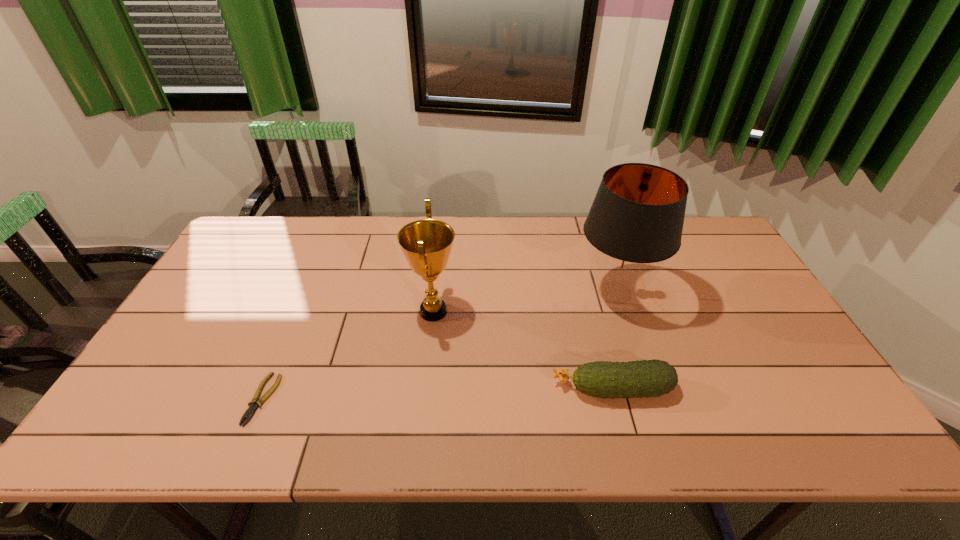
Identify the location of free space located at the blossom end of the cucumber. Image resolution: width=960 pixels, height=540 pixels. (404, 389).

Identify the location of free point located on the left of the shortest object. This screenshot has height=540, width=960. (134, 399).

This screenshot has width=960, height=540. I want to click on object that is positioned at the near edge, so click(250, 411).

At what (x,y) coordinates should I click in order to perform the action: click on free space at the far edge. Please return your answer as a coordinate pair (x, y). Looking at the image, I should click on (404, 225).

The width and height of the screenshot is (960, 540). In order to click on vacant region at the left edge of the desktop in this screenshot , I will do `click(208, 282)`.

The height and width of the screenshot is (540, 960). What are the coordinates of `vacant space at the right edge` in the screenshot? It's located at (767, 345).

This screenshot has height=540, width=960. In the image, there is a desktop. In order to click on vacant space at the far left corner in this screenshot , I will do `click(254, 222)`.

This screenshot has height=540, width=960. In order to click on vacant space at the near left corner in this screenshot , I will do `click(122, 425)`.

In the image, there is a desktop. Identify the location of vacant space at the far right corner. The width and height of the screenshot is (960, 540). (704, 242).

Image resolution: width=960 pixels, height=540 pixels. I want to click on free spot between the second shortest object and the second object from left to right, so click(x=523, y=350).